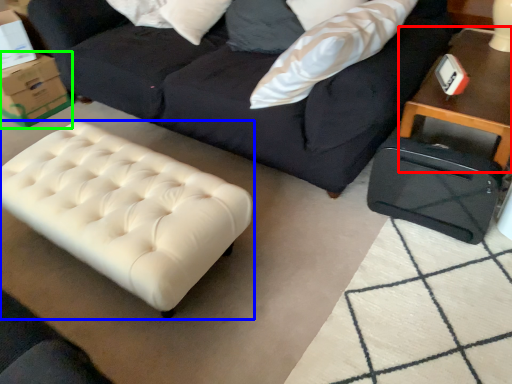
Question: Which is farther away from table (highlighted by a red box)? table (highlighted by a blue box) or cardboard box (highlighted by a green box)?

Choices:
 (A) table
 (B) cardboard box

Answer: (B)